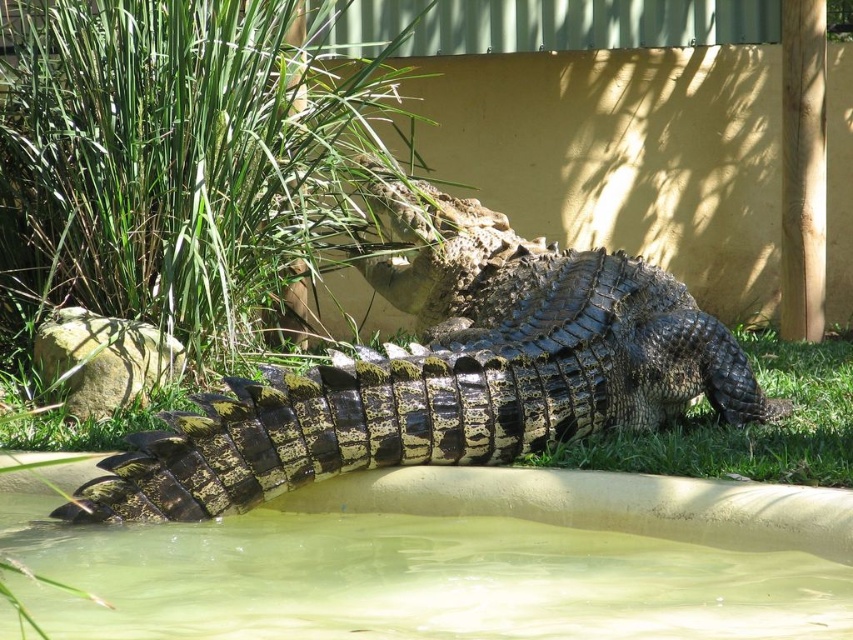
You are standing at the point closer to the crocodile in the image. Which point are you standing at, point (515, 243) or point (345, 564)?

You are standing at point (515, 243) because it is closer to the crocodile than point (345, 564).

You are a zookeeper tasked with cleaning the enclosure. The shiny black crocodile at center is currently resting on the grassy bank. To ensure safety, you need to determine if the greenish murky water at bottom is deep enough to submerge the crocodile fully. Can you confirm this?

The shiny black crocodile at center is larger in size than the greenish murky water at bottom, which means the water may not be deep enough to fully submerge the crocodile.

You are standing at the edge of the pool where the shiny black crocodile at center is resting. If you want to take a photo of the crocodile without getting too close, which direction should you face? The options are north, south, east, or west.

Since the shiny black crocodile at center is located at point coordinates approximately (445, 372), you should face north to capture it in your photo without moving closer.